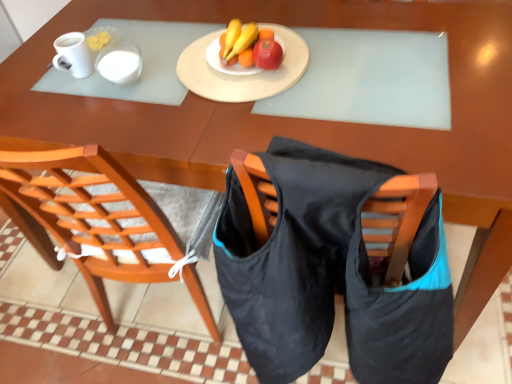
This screenshot has height=384, width=512. Identify the location of free space above matte white plate at center (from a real-world perspective). (239, 63).